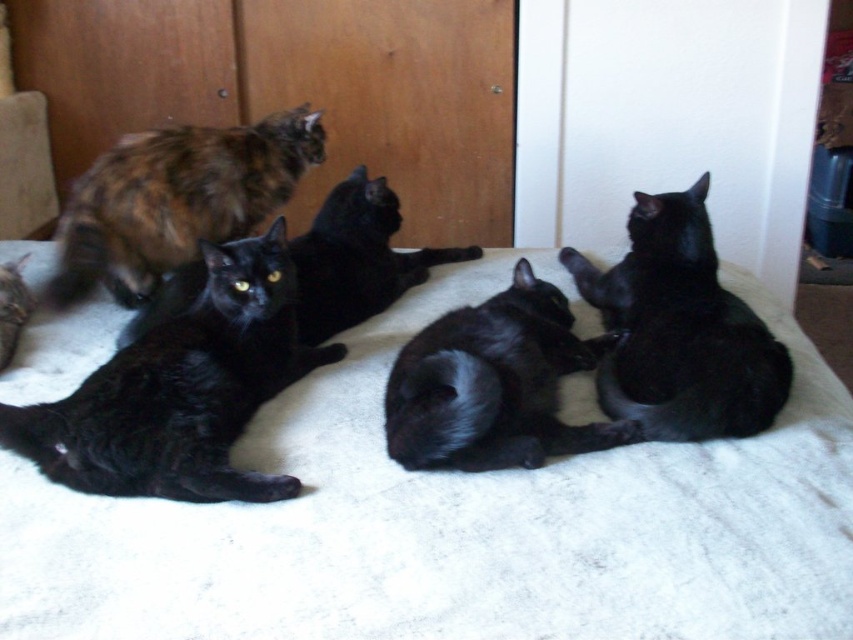
Between black glossy cat at upper right and shiny black cat at lower left, which one is positioned lower?

shiny black cat at lower left is lower down.

Which of these two, black glossy cat at upper right or shiny black cat at lower left, stands shorter?

shiny black cat at lower left

Which is in front, point (637, 417) or point (1, 332)?

Positioned in front is point (637, 417).

Where is `black glossy cat at upper right`? black glossy cat at upper right is located at coordinates (680, 330).

Between point (683, 380) and point (479, 380), which one is positioned in front?

Point (479, 380) is in front.

Can you confirm if black glossy cat at upper right is bigger than shiny black cat at center?

Correct, black glossy cat at upper right is larger in size than shiny black cat at center.

You are a GUI agent. You are given a task and a screenshot of the screen. Output one action in this format:
    pyautogui.click(x=<x>, y=<y>)
    Task: Click on the black glossy cat at upper right
    The height and width of the screenshot is (640, 853).
    Given the screenshot: What is the action you would take?
    pyautogui.click(x=680, y=330)

Locate an element on the screen. This screenshot has width=853, height=640. white soft bed at center is located at coordinates (457, 522).

Is white soft bed at center taller than black glossy cat at upper right?

Yes.

The height and width of the screenshot is (640, 853). Identify the location of white soft bed at center. (457, 522).